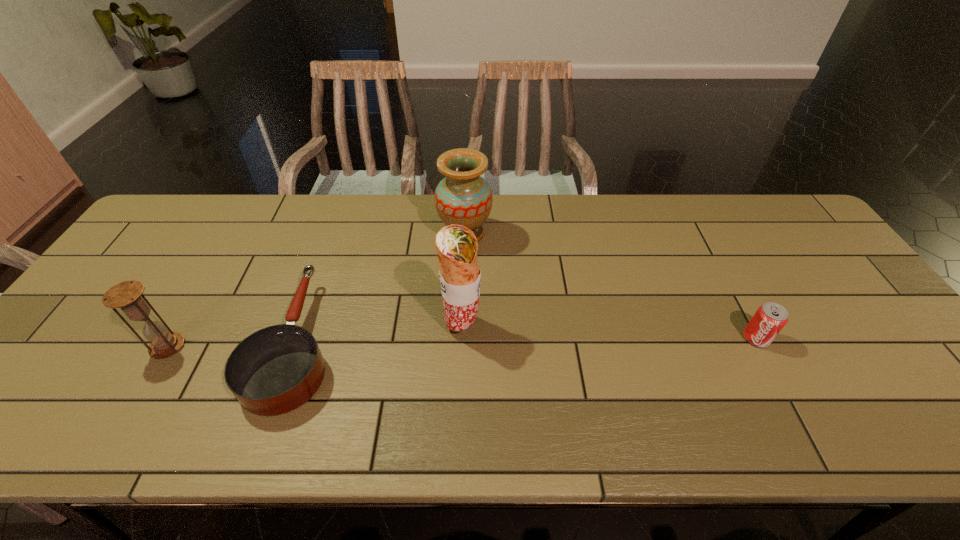
Identify the location of vacant area located on the front of the vase. This screenshot has height=540, width=960. (461, 350).

Find the location of a particular element. The image size is (960, 540). free spot located 0.180m on the left of the leftmost object is located at coordinates (77, 347).

I want to click on vacant area situated 0.290m on the left of the rightmost object, so click(x=626, y=338).

Identify the location of vacant area situated on the handle side of the shortest object. (336, 230).

Where is `blank space located on the handle side of the shortest object`? This screenshot has width=960, height=540. blank space located on the handle side of the shortest object is located at coordinates (344, 208).

Where is `free space located on the handle side of the shortest object`? The image size is (960, 540). free space located on the handle side of the shortest object is located at coordinates (332, 240).

The image size is (960, 540). Find the location of `object present at the far edge`. object present at the far edge is located at coordinates (463, 197).

You are a GUI agent. You are given a task and a screenshot of the screen. Output one action in this format:
    pyautogui.click(x=<x>, y=<y>)
    Task: Click on the object present at the near edge
    This screenshot has width=960, height=540.
    Given the screenshot: What is the action you would take?
    pyautogui.click(x=275, y=370)

I want to click on vacant region at the far edge of the desktop, so click(392, 228).

Identify the location of vacant region at the near edge of the desktop. (591, 429).